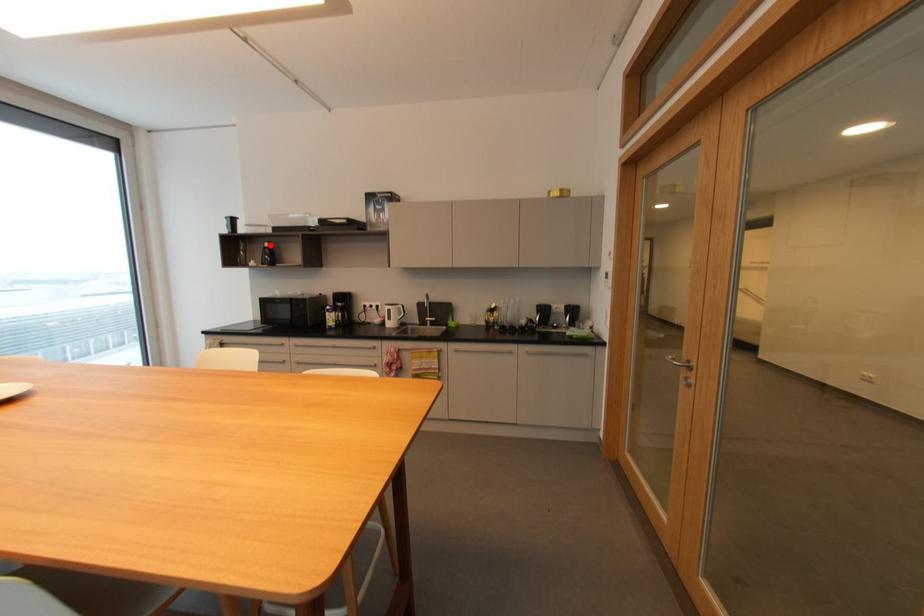
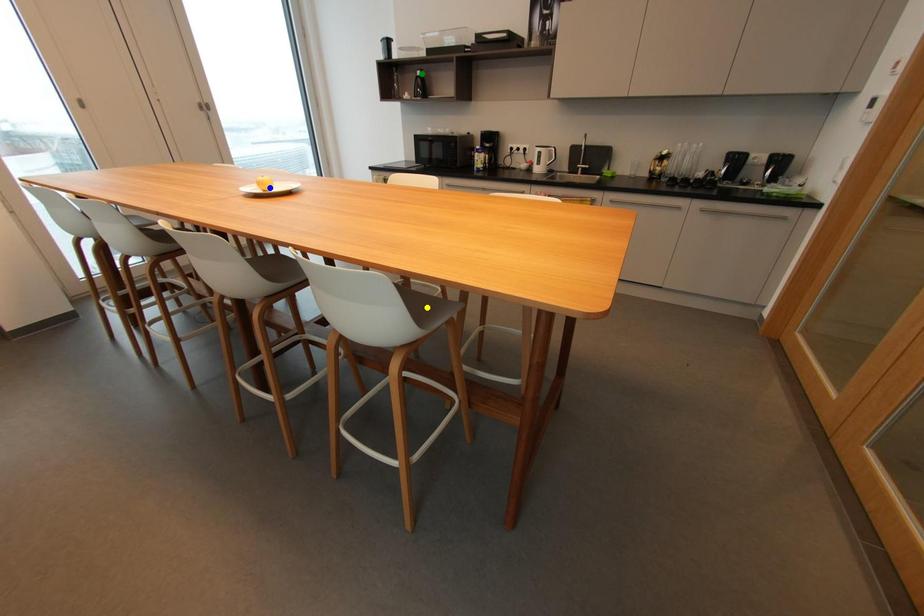
Question: I am providing you with two images of the same scene from different viewpoints. A red point is marked on the first image. You are given multiple points on the second image. In image 2, which mark is for the same physical point as the one in image 1?

Choices:
 (A) green point
 (B) yellow point
 (C) blue point

Answer: (A)